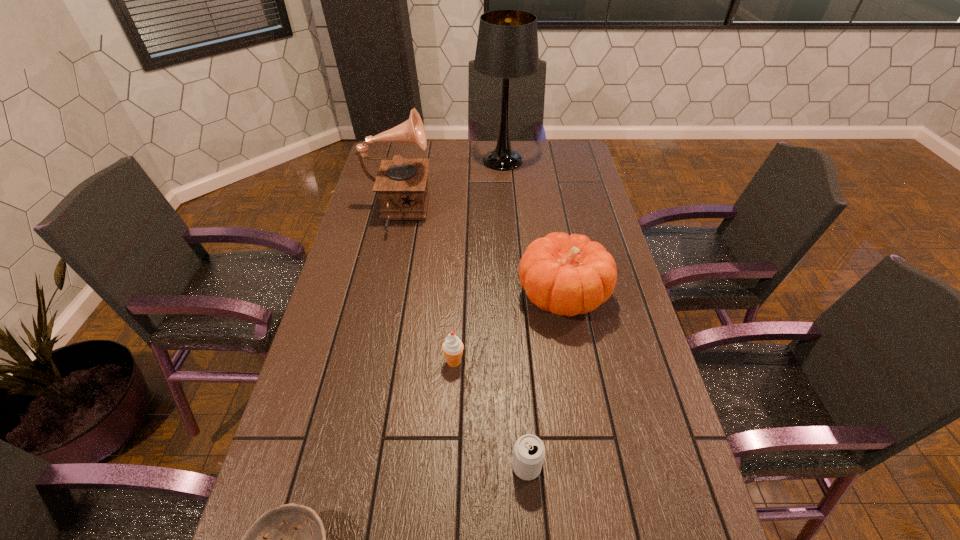
What are the coordinates of `vacant space at the right edge of the desktop` in the screenshot? It's located at (701, 506).

I want to click on free spot at the far left corner of the desktop, so click(406, 147).

The width and height of the screenshot is (960, 540). In the image, there is a desktop. Identify the location of vacant region at the far right corner. (572, 145).

I want to click on free space between the fourth farthest object and the third tallest object, so click(x=509, y=329).

You are a GUI agent. You are given a task and a screenshot of the screen. Output one action in this format:
    pyautogui.click(x=<x>, y=<y>)
    Task: Click on the free spot between the farthest object and the can
    This screenshot has width=960, height=540.
    Given the screenshot: What is the action you would take?
    pyautogui.click(x=515, y=314)

Where is `vacant space that's between the fourth nearest object and the fifth farthest object`? The width and height of the screenshot is (960, 540). vacant space that's between the fourth nearest object and the fifth farthest object is located at coordinates (544, 382).

You are a GUI agent. You are given a task and a screenshot of the screen. Output one action in this format:
    pyautogui.click(x=<x>, y=<y>)
    Task: Click on the free spot between the third farthest object and the fifth farthest object
    
    Given the screenshot: What is the action you would take?
    pyautogui.click(x=544, y=382)

Locate an element on the screen. vacant area that lies between the icecream and the record player is located at coordinates (425, 288).

You are a GUI agent. You are given a task and a screenshot of the screen. Output one action in this format:
    pyautogui.click(x=<x>, y=<y>)
    Task: Click on the object that is the fourth closest to the second farthest object
    
    Given the screenshot: What is the action you would take?
    pyautogui.click(x=529, y=451)

Identify which object is the fourth closest to the can. Please provide its 2D coordinates. Your answer should be formatted as a tuple, i.e. [(x, y)], where the tuple contains the x and y coordinates of a point satisfying the conditions above.

[(401, 183)]